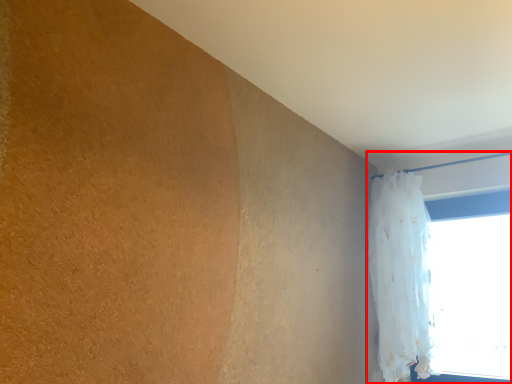
Question: From the image's perspective, considering the relative positions of window (annotated by the red box) and curtain in the image provided, where is window (annotated by the red box) located with respect to the staircase?

Choices:
 (A) below
 (B) above

Answer: (A)